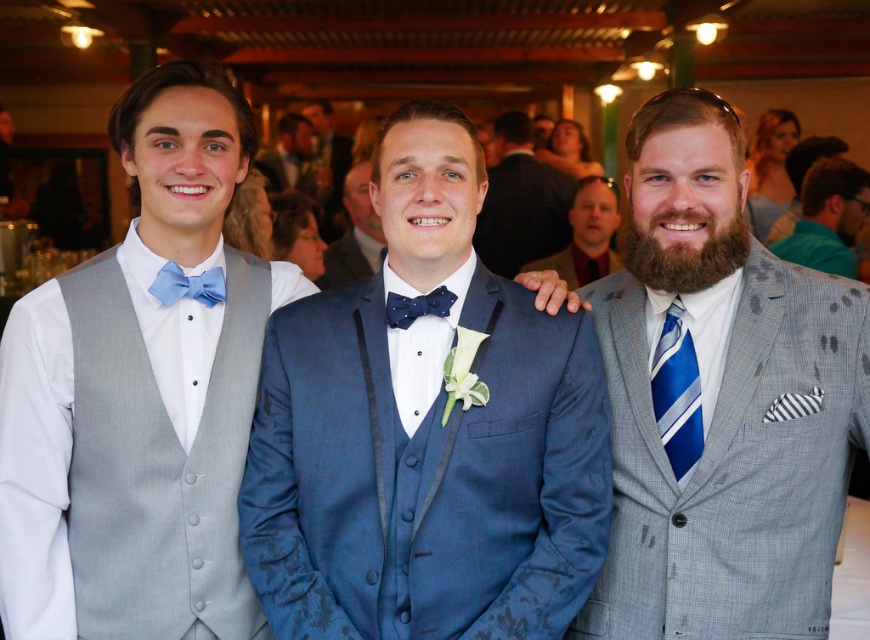
Who is positioned more to the right, teal fabric shirt at upper right or matte blue bow tie at center?

Positioned to the right is teal fabric shirt at upper right.

Is teal fabric shirt at upper right above matte blue bow tie at center?

Yes.

Is point (825, 179) closer to viewer compared to point (362, 275)?

No.

What are the coordinates of `teal fabric shirt at upper right` in the screenshot? It's located at (828, 218).

Between navy blue suit at center and blue textured suit at center, which one is positioned lower?

navy blue suit at center is lower down.

Can you confirm if navy blue suit at center is positioned above blue textured suit at center?

No.

Which is behind, point (574, 595) or point (529, 268)?

Positioned behind is point (529, 268).

At what (x,y) coordinates should I click in order to perform the action: click on navy blue suit at center. Please return your answer as a coordinate pair (x, y). This screenshot has width=870, height=640. Looking at the image, I should click on (425, 433).

Is blue striped tie at center closer to the viewer compared to blue textured suit at center?

No.

Does point (604, 209) lie in front of point (573, 246)?

Yes, point (604, 209) is closer to viewer.

In order to click on blue striped tie at center in this screenshot , I will do tap(586, 237).

The image size is (870, 640). Identify the location of blue striped tie at center. (586, 237).